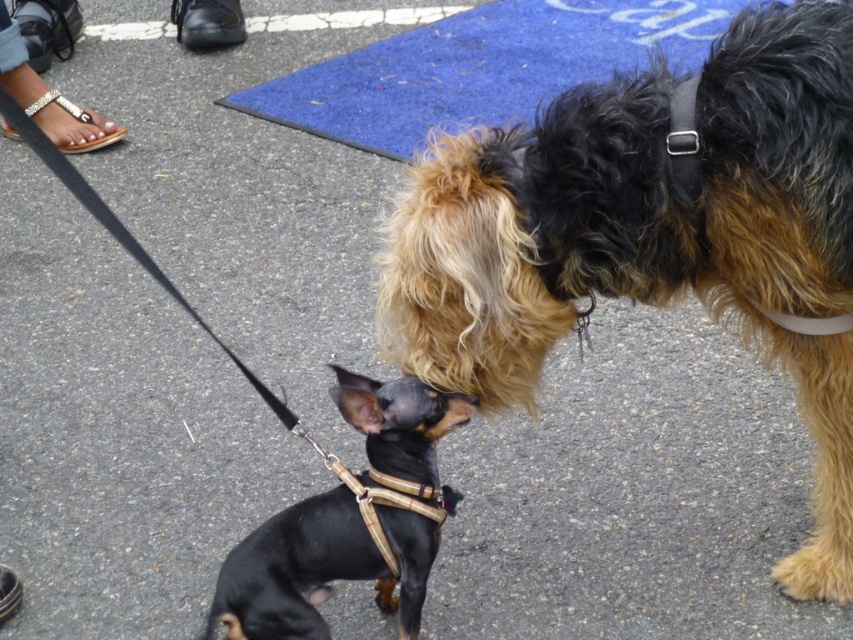
Question: Does black and tan fur at center have a smaller size compared to black leather harness at center?

Choices:
 (A) yes
 (B) no

Answer: (B)

Question: Does black and tan fur at center appear on the right side of black leather harness at center?

Choices:
 (A) yes
 (B) no

Answer: (A)

Question: Is black and tan fur at center to the right of black leather harness at center from the viewer's perspective?

Choices:
 (A) yes
 (B) no

Answer: (A)

Question: Which point is farther to the camera?

Choices:
 (A) (798, 308)
 (B) (299, 548)

Answer: (B)

Question: Among these points, which one is nearest to the camera?

Choices:
 (A) (354, 534)
 (B) (804, 80)

Answer: (B)